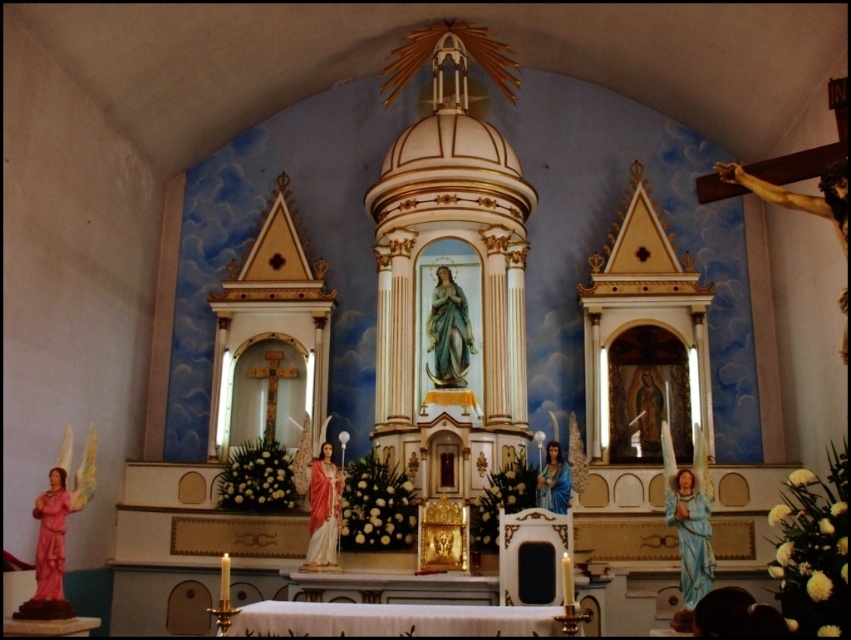
You are standing at the entrance of the church and want to locate two specific points in the altar area. The first point is at coordinates point (x=757, y=180) and the second is at point (x=558, y=490). Which of these two points is nearer to you?

Point (x=757, y=180) is closer to the viewer than point (x=558, y=490).

You are a visitor standing at the entrance of the church, facing the altar area. You notice the blue glossy statue at lower right and the wooden crucifix at right. Which object is positioned further away from you?

The wooden crucifix at right is behind the blue glossy statue at lower right, so it is further away from you.